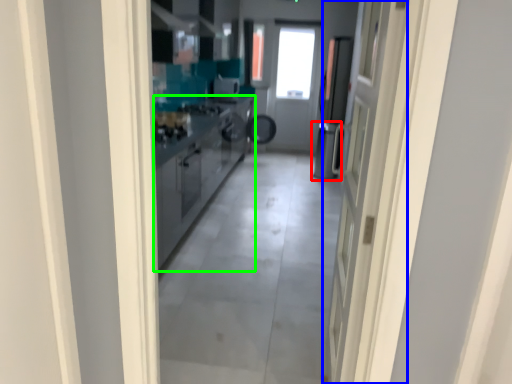
Question: Which is nearer to the dish washer (highlighted by a red box)? door (highlighted by a blue box) or cabinetry (highlighted by a green box).

Choices:
 (A) door
 (B) cabinetry

Answer: (B)